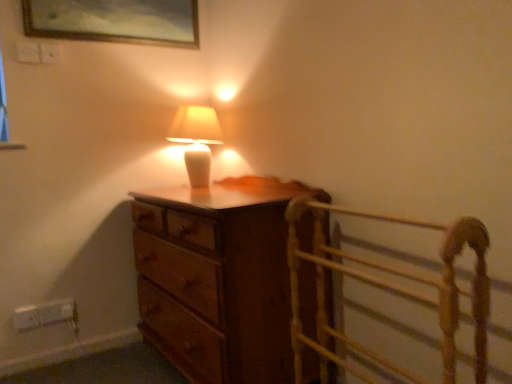
Question: Are white plastic electric outlet at lower left, arranged as the second electric outlet when viewed from the left, and wooden bed frame at right making contact?

Choices:
 (A) yes
 (B) no

Answer: (B)

Question: Is white plastic electric outlet at lower left, positioned as the 1th electric outlet in right-to-left order, positioned with its back to wooden bed frame at right?

Choices:
 (A) no
 (B) yes

Answer: (A)

Question: Could you tell me if white plastic electric outlet at lower left, positioned as the 1th electric outlet in right-to-left order, is turned towards wooden bed frame at right?

Choices:
 (A) no
 (B) yes

Answer: (B)

Question: Considering the relative positions of white plastic electric outlet at lower left, arranged as the second electric outlet when viewed from the left, and wooden bed frame at right in the image provided, is white plastic electric outlet at lower left, arranged as the second electric outlet when viewed from the left, behind wooden bed frame at right?

Choices:
 (A) yes
 (B) no

Answer: (A)

Question: From the image's perspective, is white plastic electric outlet at lower left, positioned as the 1th electric outlet in right-to-left order, under wooden bed frame at right?

Choices:
 (A) no
 (B) yes

Answer: (B)

Question: Considering the positions of point (145, 306) and point (183, 21), is point (145, 306) closer or farther from the camera than point (183, 21)?

Choices:
 (A) farther
 (B) closer

Answer: (B)

Question: Considering their positions, is wooden chest of drawers at center located in front of or behind gold-framed painting at upper center?

Choices:
 (A) behind
 (B) front

Answer: (B)

Question: From the image's perspective, is wooden chest of drawers at center above or below gold-framed painting at upper center?

Choices:
 (A) above
 (B) below

Answer: (B)

Question: Is wooden chest of drawers at center situated inside gold-framed painting at upper center or outside?

Choices:
 (A) inside
 (B) outside

Answer: (B)

Question: Considering the relative positions of gold-framed painting at upper center and wooden chest of drawers at center in the image provided, is gold-framed painting at upper center to the left or to the right of wooden chest of drawers at center?

Choices:
 (A) right
 (B) left

Answer: (B)

Question: In terms of width, does gold-framed painting at upper center look wider or thinner when compared to wooden chest of drawers at center?

Choices:
 (A) thin
 (B) wide

Answer: (A)

Question: Is point (78, 33) closer or farther from the camera than point (196, 309)?

Choices:
 (A) farther
 (B) closer

Answer: (A)

Question: Is gold-framed painting at upper center taller or shorter than wooden chest of drawers at center?

Choices:
 (A) tall
 (B) short

Answer: (B)

Question: In the image, is gold-framed painting at upper center positioned in front of or behind wooden bed frame at right?

Choices:
 (A) front
 (B) behind

Answer: (B)

Question: Considering the relative positions of gold-framed painting at upper center and wooden bed frame at right in the image provided, is gold-framed painting at upper center to the left or to the right of wooden bed frame at right?

Choices:
 (A) right
 (B) left

Answer: (B)